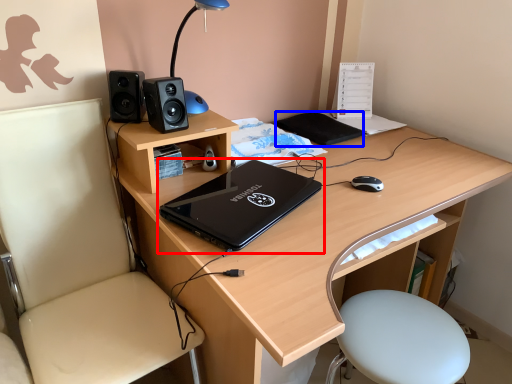
Question: Which of the following is the closest to the observer, laptop (highlighted by a red box) or notepad (highlighted by a blue box)?

Choices:
 (A) laptop
 (B) notepad

Answer: (A)